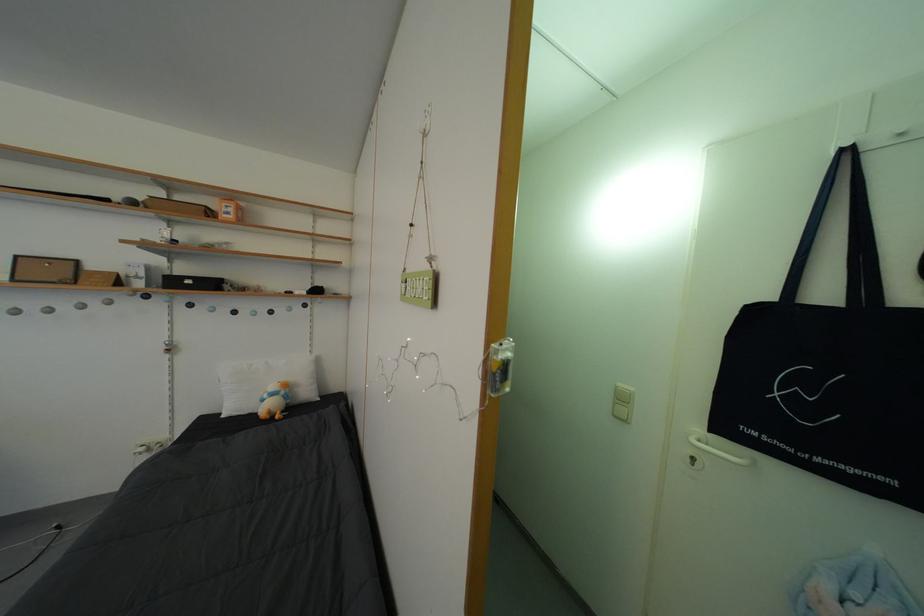
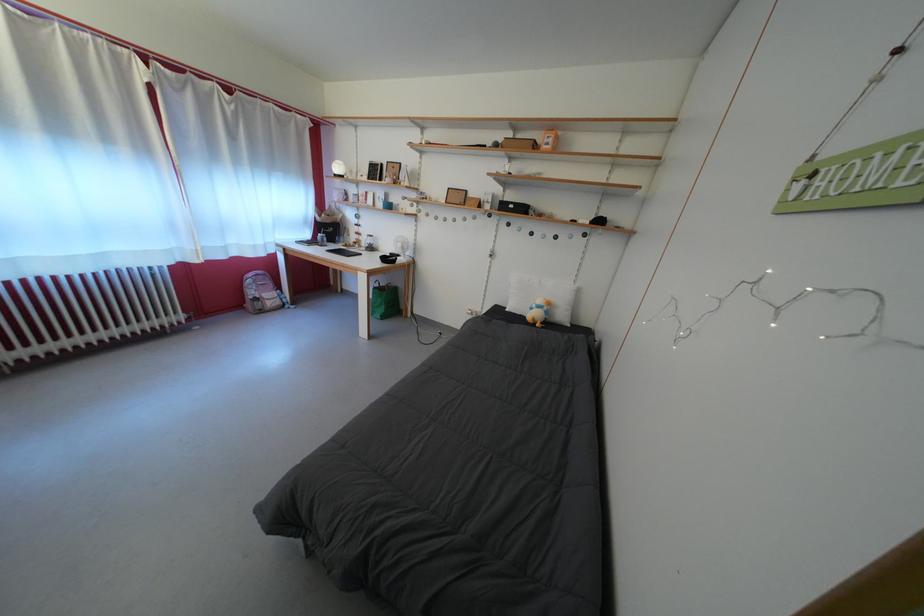
Where in the second image is the point corresponding to [198,288] from the first image?

(519, 213)